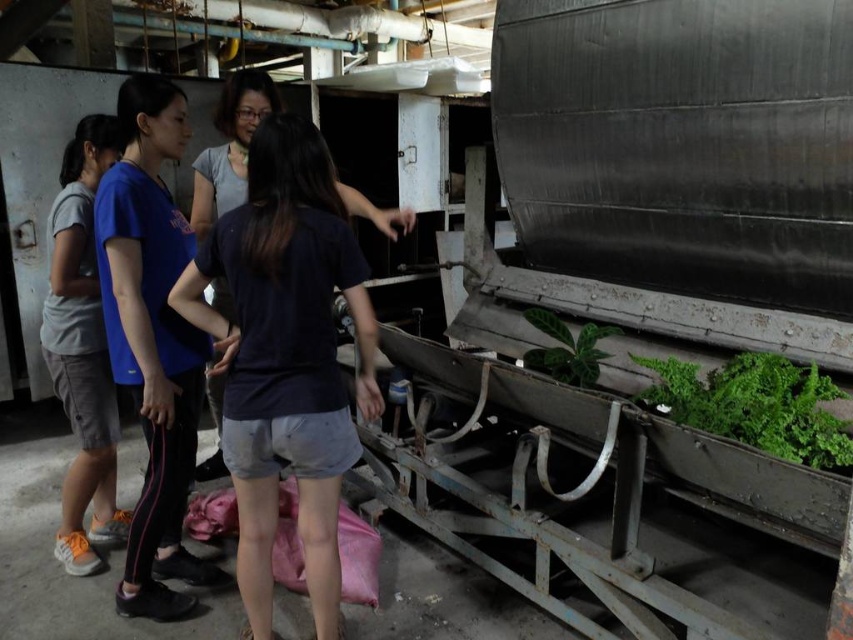
You are a photographer setting up a shoot in this workshop. You need to position a light to the left of both the blue fabric pants at left and the matte gray shorts at left. Is this possible given their current arrangement?

The blue fabric pants at left are to the right of the matte gray shorts at left, so positioning a light to the left of both would require placing it to the left of the matte gray shorts at left, which is feasible as there is space available on that side.

You are a maintenance worker in the workshop and need to reach the green leafy plant at right. Based on its position, can you estimate how far it is from the bottom of the tank?

The green leafy plant at right is located at point [755,404], which means it is approximately 88.6 percent from the bottom of the tank. Therefore, it is about 88.6 percent up the tank from the bottom.